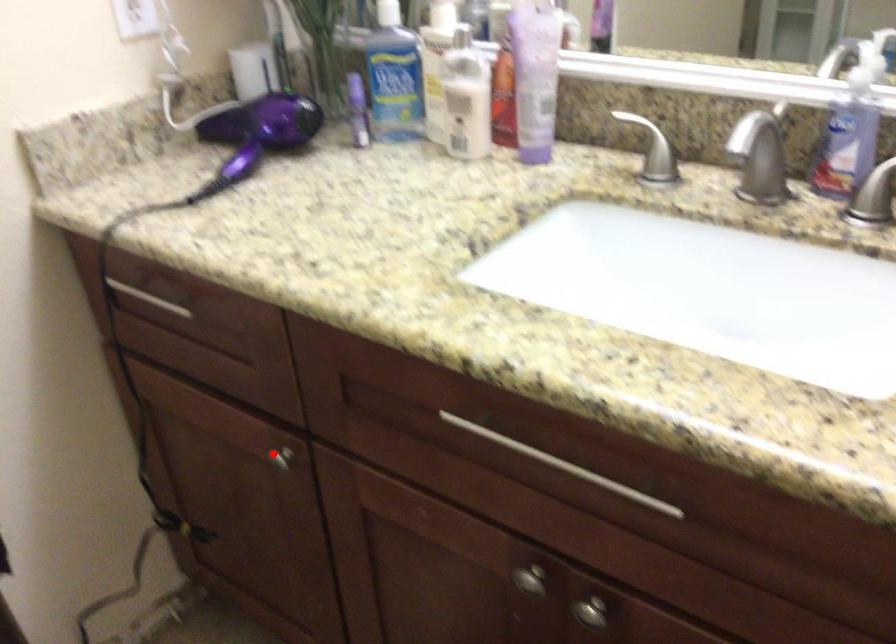
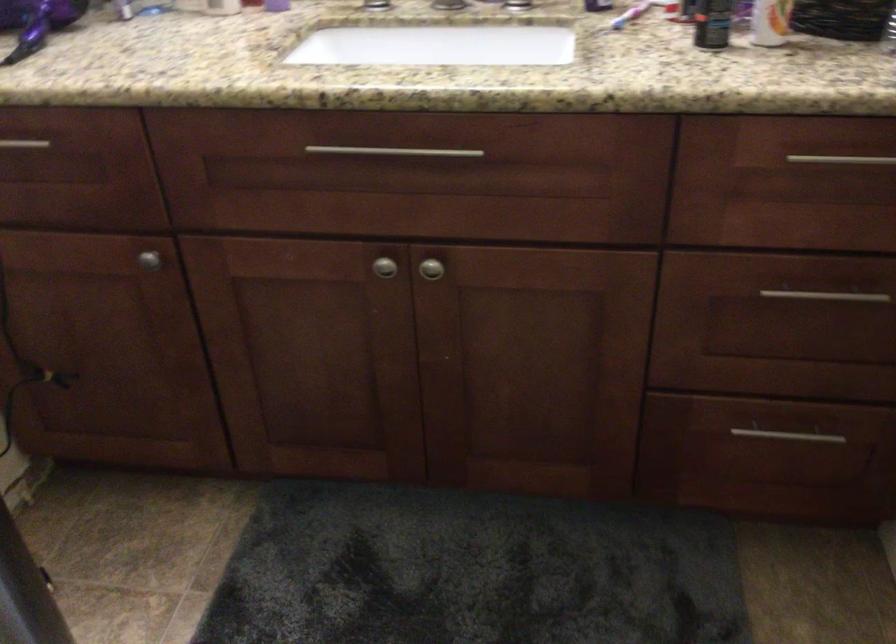
In the second image, find the point that corresponds to the highlighted location in the first image.

(149, 259)